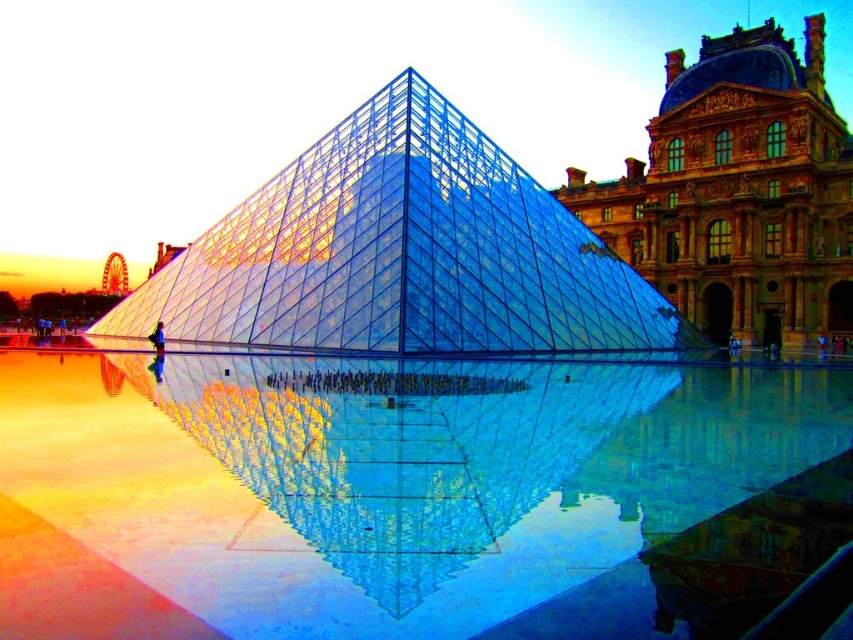
Question: Which point is closer to the camera?

Choices:
 (A) transparent glass pool at center
 (B) transparent glass pyramid at center

Answer: (A)

Question: Which of these objects is positioned farthest from the transparent glass pyramid at center?

Choices:
 (A) transparent glass pool at center
 (B) marble stone palace at upper right

Answer: (B)

Question: Does transparent glass pool at center have a greater width compared to marble stone palace at upper right?

Choices:
 (A) yes
 (B) no

Answer: (A)

Question: Which object appears farthest from the camera in this image?

Choices:
 (A) transparent glass pool at center
 (B) marble stone palace at upper right

Answer: (B)

Question: Can you confirm if transparent glass pyramid at center is positioned to the right of marble stone palace at upper right?

Choices:
 (A) yes
 (B) no

Answer: (B)

Question: Does transparent glass pool at center have a larger size compared to marble stone palace at upper right?

Choices:
 (A) yes
 (B) no

Answer: (A)